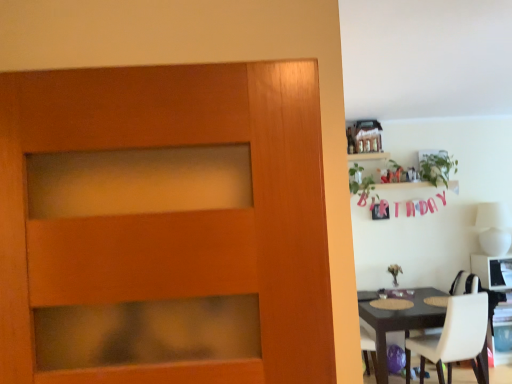
Question: Can you confirm if green leafy plant at upper right, which is the 2th plant from left to right, is smaller than wooden shelf at upper right?

Choices:
 (A) no
 (B) yes

Answer: (A)

Question: Is green leafy plant at upper right, which is counted as the first plant, starting from the right, not within wooden shelf at upper right?

Choices:
 (A) yes
 (B) no

Answer: (A)

Question: Is green leafy plant at upper right, which is counted as the first plant, starting from the right, next to wooden shelf at upper right and touching it?

Choices:
 (A) yes
 (B) no

Answer: (B)

Question: Considering the relative positions of green leafy plant at upper right, which is the 2th plant from left to right, and wooden shelf at upper right in the image provided, is green leafy plant at upper right, which is the 2th plant from left to right, behind wooden shelf at upper right?

Choices:
 (A) yes
 (B) no

Answer: (B)

Question: Is wooden shelf at upper right at the back of green leafy plant at upper right, which is counted as the first plant, starting from the right?

Choices:
 (A) yes
 (B) no

Answer: (B)

Question: From the image's perspective, is green leafy plant at upper right, which is the 2th plant from left to right, located above wooden shelf at upper right?

Choices:
 (A) no
 (B) yes

Answer: (A)

Question: From a real-world perspective, is green leafy plant at upper right, which is the 2th plant from left to right, physically below green leafy plant at upper right, positioned as the 2th plant in right-to-left order?

Choices:
 (A) yes
 (B) no

Answer: (B)

Question: Does green leafy plant at upper right, which is counted as the first plant, starting from the right, have a smaller size compared to green leafy plant at upper right, positioned as the 2th plant in right-to-left order?

Choices:
 (A) no
 (B) yes

Answer: (B)

Question: Is green leafy plant at upper right, which is the 2th plant from left to right, to the right of green leafy plant at upper right, which is the first plant in left-to-right order, from the viewer's perspective?

Choices:
 (A) no
 (B) yes

Answer: (B)

Question: Is green leafy plant at upper right, which is counted as the first plant, starting from the right, aimed at green leafy plant at upper right, positioned as the 2th plant in right-to-left order?

Choices:
 (A) no
 (B) yes

Answer: (A)

Question: Is green leafy plant at upper right, which is the 2th plant from left to right, positioned before green leafy plant at upper right, which is the first plant in left-to-right order?

Choices:
 (A) yes
 (B) no

Answer: (B)

Question: From a real-world perspective, is green leafy plant at upper right, which is counted as the first plant, starting from the right, on top of green leafy plant at upper right, which is the first plant in left-to-right order?

Choices:
 (A) no
 (B) yes

Answer: (B)

Question: From a real-world perspective, is matte brown table at right over white glossy computer desk at right?

Choices:
 (A) no
 (B) yes

Answer: (A)